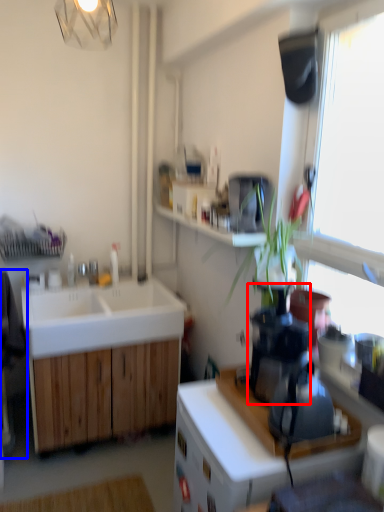
Question: Which object appears farthest to the camera in this image, coffee machine (highlighted by a red box) or swivel chair (highlighted by a blue box)?

Choices:
 (A) coffee machine
 (B) swivel chair

Answer: (B)